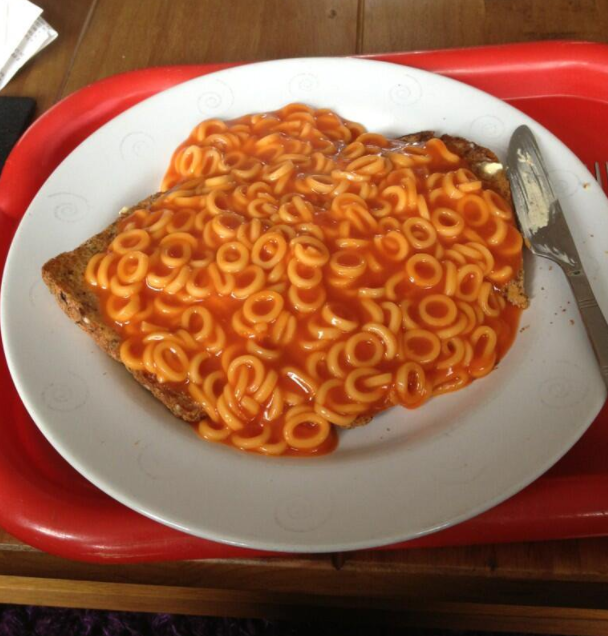
Find the location of `small hole in table`. small hole in table is located at coordinates (331, 13).